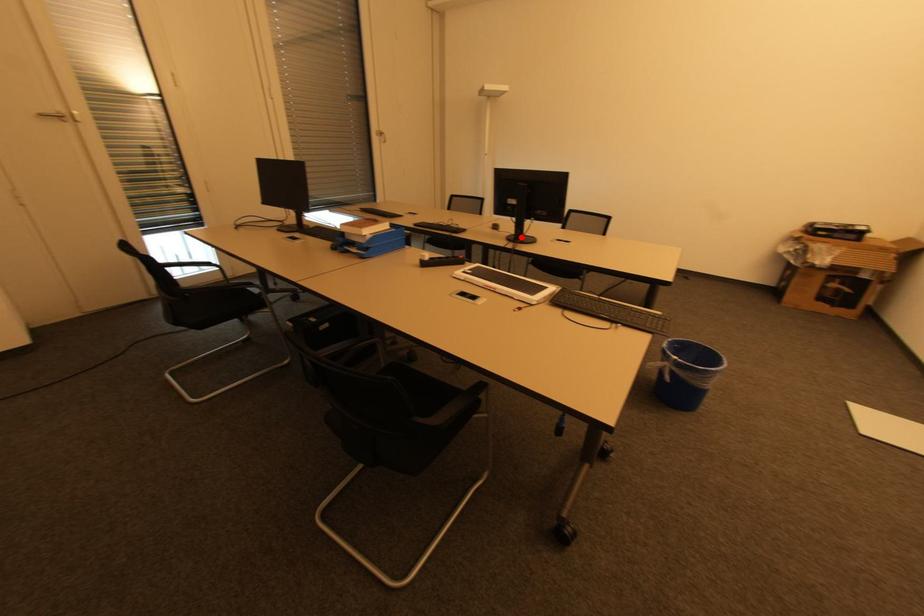
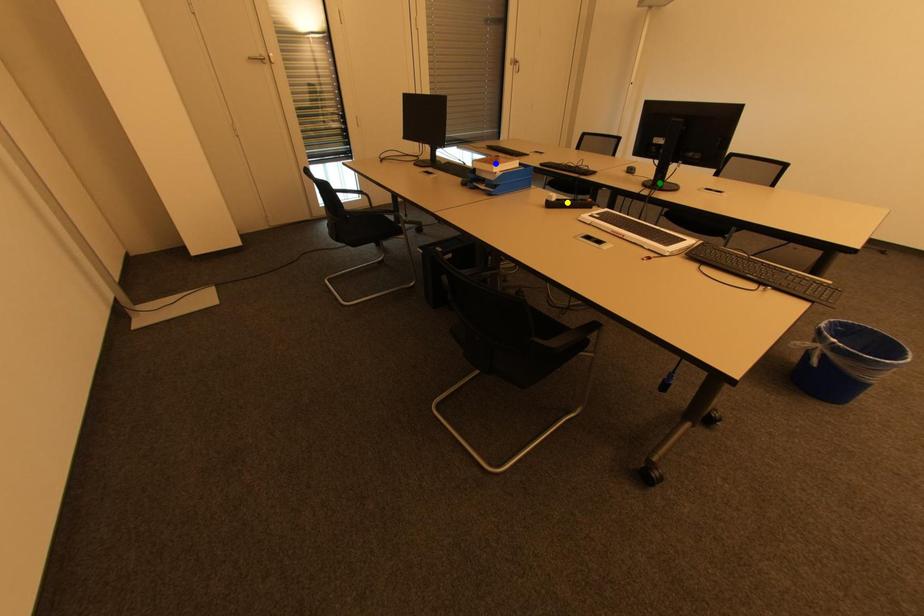
Question: I am providing you with two images of the same scene from different viewpoints. A red point is marked on the first image. You are given multiple points on the second image. Which point in image 2 is actually the same real-world point as the red point in image 1?

Choices:
 (A) blue point
 (B) green point
 (C) yellow point

Answer: (B)